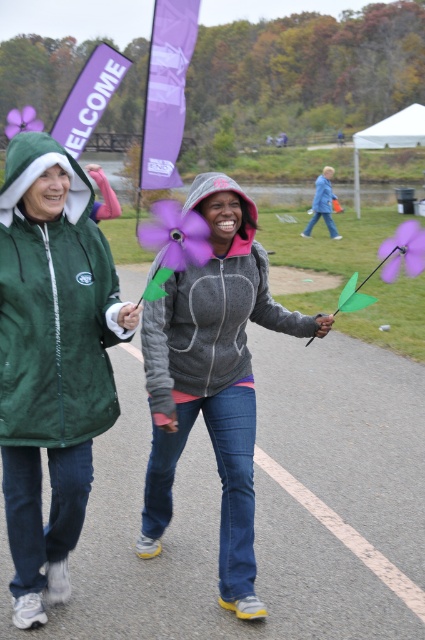
Does green fleece jacket at left have a larger size compared to gray hoodie at center?

Incorrect, green fleece jacket at left is not larger than gray hoodie at center.

The width and height of the screenshot is (425, 640). What do you see at coordinates (51, 358) in the screenshot? I see `green fleece jacket at left` at bounding box center [51, 358].

This screenshot has height=640, width=425. Find the location of `green fleece jacket at left`. green fleece jacket at left is located at coordinates (51, 358).